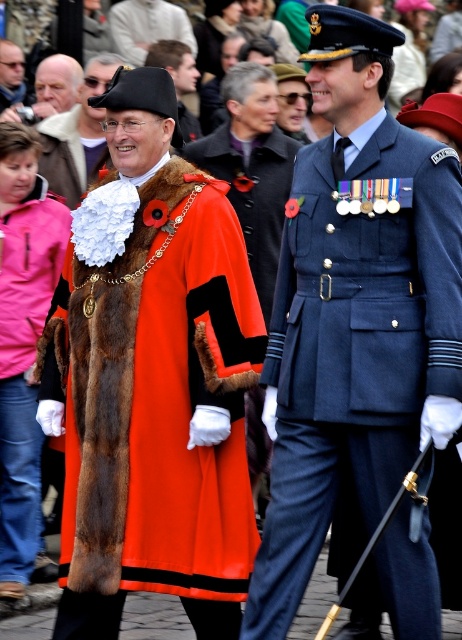
Question: Can you confirm if velvet red coat at center is smaller than matte black hat at upper left?

Choices:
 (A) no
 (B) yes

Answer: (A)

Question: Is velvet red coat at center in front of matte black hat at upper left?

Choices:
 (A) yes
 (B) no

Answer: (A)

Question: Is brown fur coat at center positioned behind velvet black hat at center?

Choices:
 (A) yes
 (B) no

Answer: (B)

Question: Among these points, which one is nearest to the camera?

Choices:
 (A) (368, 156)
 (B) (79, 278)
 (C) (44, 97)

Answer: (A)

Question: Which object is positioned farthest from the velvet red cape at center?

Choices:
 (A) matte black uniform at center
 (B) shiny black hat at upper left
 (C) velvet black hat at center
 (D) matte black hat at upper left

Answer: (A)

Question: Which of the following is the farthest from the observer?

Choices:
 (A) (46, 104)
 (B) (1, 77)
 (C) (180, 106)

Answer: (C)